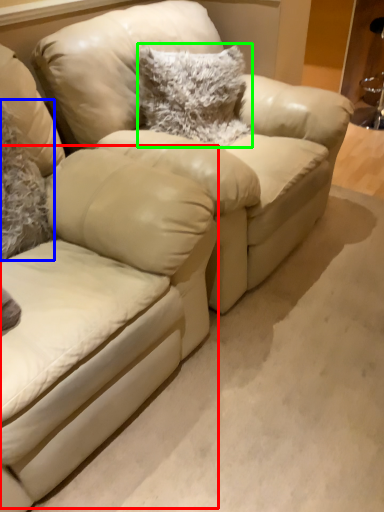
Question: Which object is the farthest from swivel chair (highlighted by a red box)? Choose among these: pillow (highlighted by a blue box) or pillow (highlighted by a green box).

Choices:
 (A) pillow
 (B) pillow

Answer: (B)